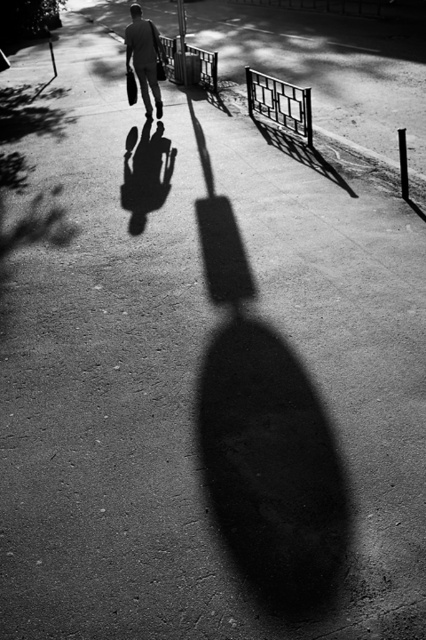
Question: Which of these objects is positioned farthest from the metallic grid fence at upper center?

Choices:
 (A) metallic gate at upper center
 (B) dark gray suit at center

Answer: (A)

Question: Which object is the farthest from the metallic gate at upper center?

Choices:
 (A) dark gray suit at center
 (B) metallic grid fence at upper center

Answer: (B)

Question: Which object is the closest to the metallic grid fence at upper center?

Choices:
 (A) metallic gate at upper center
 (B) dark gray suit at center

Answer: (B)

Question: Where is dark gray suit at center located in relation to metallic gate at upper center in the image?

Choices:
 (A) right
 (B) left

Answer: (B)

Question: In this image, where is metallic grid fence at upper center located relative to metallic gate at upper center?

Choices:
 (A) right
 (B) left

Answer: (A)

Question: Considering the relative positions of metallic grid fence at upper center and metallic gate at upper center in the image provided, where is metallic grid fence at upper center located with respect to metallic gate at upper center?

Choices:
 (A) right
 (B) left

Answer: (A)